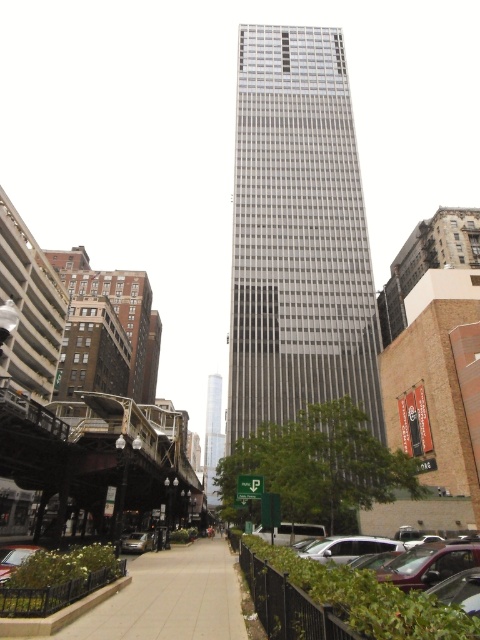
Which of these two, matte purple car at lower right or metallic silver car at lower left, stands taller?

With more height is metallic silver car at lower left.

Can you confirm if matte purple car at lower right is thinner than metallic silver car at lower left?

Correct, matte purple car at lower right's width is less than metallic silver car at lower left's.

Who is more distant from viewer, [476,563] or [28,552]?

The point [28,552] is behind.

The image size is (480, 640). In order to click on matte purple car at lower right in this screenshot , I will do `click(429, 563)`.

Find the location of `glassy reflective skyscraper at center`. glassy reflective skyscraper at center is located at coordinates (213, 436).

Is point (218, 374) more distant than point (1, 547)?

Yes, point (218, 374) is behind point (1, 547).

Is point (215, 380) in front of point (1, 564)?

No, (215, 380) is behind (1, 564).

This screenshot has height=640, width=480. What are the coordinates of `glassy reflective skyscraper at center` in the screenshot? It's located at (213, 436).

Between metallic silver car at lower right and matte silver car at lower left, which one is positioned lower?

matte silver car at lower left

Looking at this image, can you confirm if metallic silver car at lower right is thinner than matte silver car at lower left?

Indeed, metallic silver car at lower right has a lesser width compared to matte silver car at lower left.

Image resolution: width=480 pixels, height=640 pixels. Describe the element at coordinates (459, 589) in the screenshot. I see `metallic silver car at lower right` at that location.

Locate an element on the screen. metallic silver car at lower right is located at coordinates (459, 589).